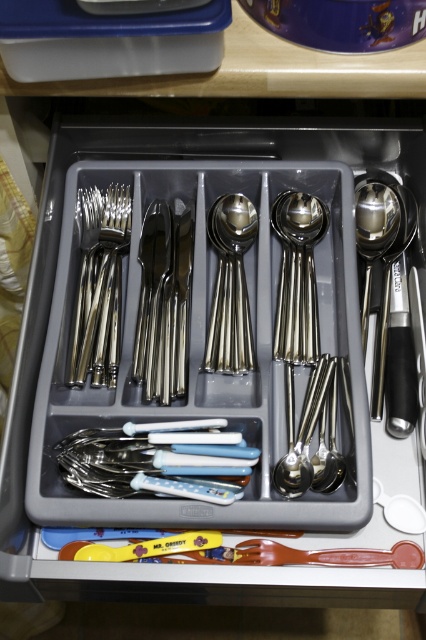
You are trying to stack the satin silver forks at left and the satin silver spoon at center into a taller utensil. Which one should you place at the bottom to make the stack as tall as possible?

Since the satin silver forks at left are taller than the satin silver spoon at center, placing the forks at the bottom would create a taller stack.

You are standing in front of the drawer and want to reach the point at coordinates point (74, 316). If your hand can extend 30 inches forward, will you be able to reach it?

The point (74, 316) is 29.95 inches away from the viewer. Since your hand can extend 30 inches forward, you can just barely reach it.